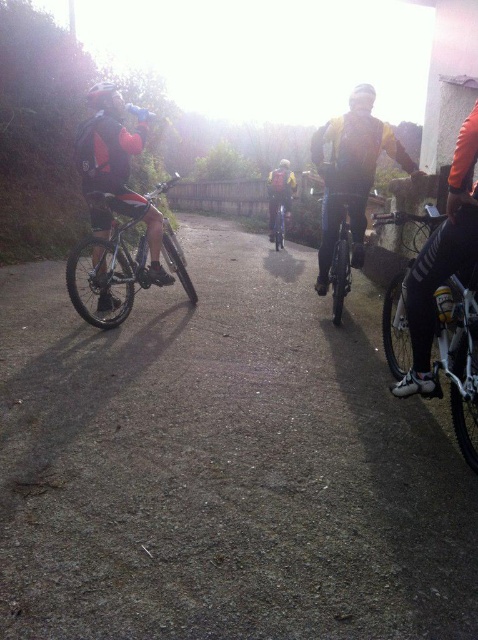
From the picture: You are a cyclist approaching the dirt track at center and the shiny silver bicycle at center. Which one is closer to you as you look ahead?

The dirt track at center is closer because it is positioned in front of the shiny silver bicycle at center.

In the scene shown: You are a cyclist approaching the path and see the shiny metallic bicycle at center and the matte black helmet at left. Which object is closer to you as you approach the path?

The shiny metallic bicycle at center is closer to you because the matte black helmet at left is behind it.